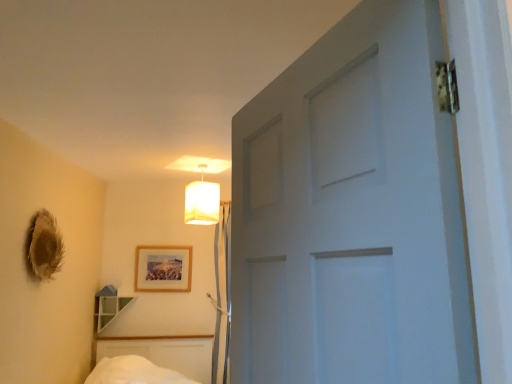
Question: Is clear glass shelf at lower left wider than wooden picture frame at center?

Choices:
 (A) yes
 (B) no

Answer: (A)

Question: From a real-world perspective, is clear glass shelf at lower left on wooden picture frame at center?

Choices:
 (A) no
 (B) yes

Answer: (A)

Question: Does clear glass shelf at lower left appear on the right side of wooden picture frame at center?

Choices:
 (A) no
 (B) yes

Answer: (A)

Question: Could wooden picture frame at center be considered to be inside clear glass shelf at lower left?

Choices:
 (A) yes
 (B) no

Answer: (B)

Question: From a real-world perspective, is clear glass shelf at lower left positioned under wooden picture frame at center based on gravity?

Choices:
 (A) yes
 (B) no

Answer: (A)

Question: Considering the positions of wooden picture frame at center and matte white lampshade at upper center in the image, is wooden picture frame at center wider or thinner than matte white lampshade at upper center?

Choices:
 (A) wide
 (B) thin

Answer: (B)

Question: Does point (186, 263) appear closer or farther from the camera than point (202, 205)?

Choices:
 (A) farther
 (B) closer

Answer: (A)

Question: Based on their sizes in the image, would you say wooden picture frame at center is bigger or smaller than matte white lampshade at upper center?

Choices:
 (A) small
 (B) big

Answer: (A)

Question: From their relative heights in the image, would you say wooden picture frame at center is taller or shorter than matte white lampshade at upper center?

Choices:
 (A) tall
 (B) short

Answer: (B)

Question: Is wooden picture frame at center bigger or smaller than clear glass shelf at lower left?

Choices:
 (A) big
 (B) small

Answer: (B)

Question: Considering the positions of wooden picture frame at center and clear glass shelf at lower left in the image, is wooden picture frame at center wider or thinner than clear glass shelf at lower left?

Choices:
 (A) wide
 (B) thin

Answer: (B)

Question: From their relative heights in the image, would you say wooden picture frame at center is taller or shorter than clear glass shelf at lower left?

Choices:
 (A) tall
 (B) short

Answer: (A)

Question: From the image's perspective, is wooden picture frame at center positioned above or below clear glass shelf at lower left?

Choices:
 (A) below
 (B) above

Answer: (B)

Question: Considering the positions of point (104, 326) and point (156, 273), is point (104, 326) closer or farther from the camera than point (156, 273)?

Choices:
 (A) farther
 (B) closer

Answer: (B)

Question: Based on their positions, is clear glass shelf at lower left located to the left or right of wooden picture frame at center?

Choices:
 (A) right
 (B) left

Answer: (B)